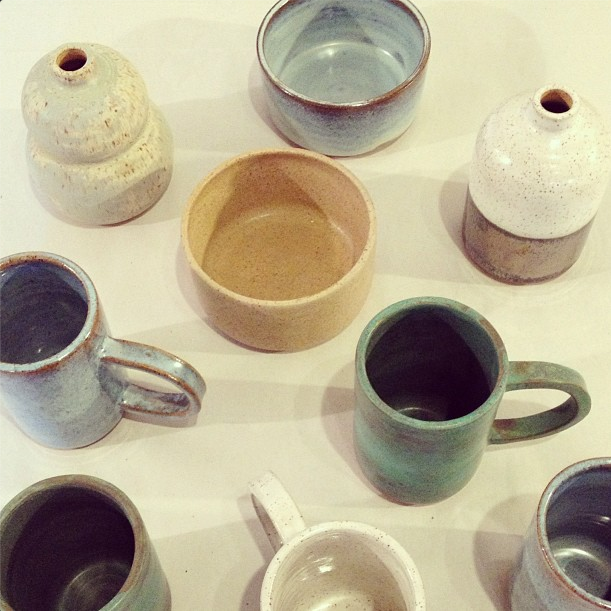
Locate an element on the screen. vase is located at coordinates (530, 170), (100, 145).